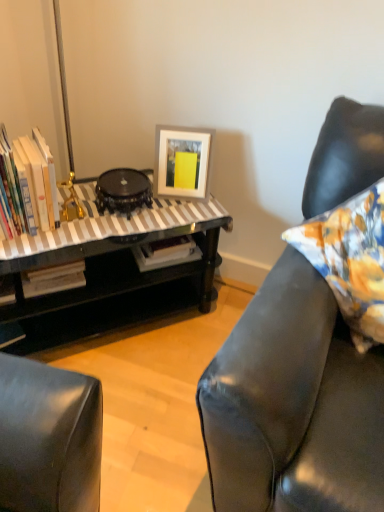
Identify the location of vacant area in front of black glossy round table at center. This screenshot has width=384, height=512. (110, 229).